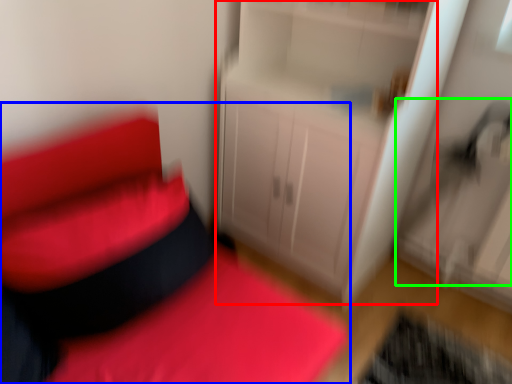
Question: Which object is the farthest from dresser (highlighted by a red box)? Choose among these: furniture (highlighted by a blue box) or swivel chair (highlighted by a green box).

Choices:
 (A) furniture
 (B) swivel chair

Answer: (A)